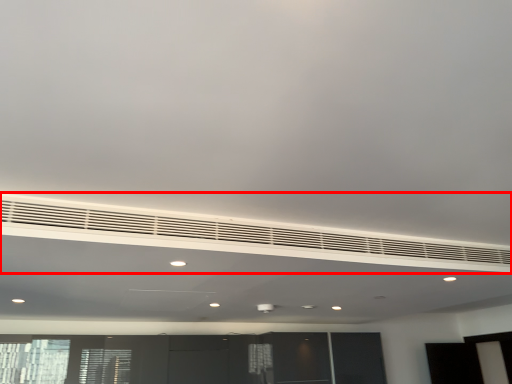
Question: From the image's perspective, what is the correct spatial relationship of air conditioning (annotated by the red box) in relation to entertainment center?

Choices:
 (A) above
 (B) below

Answer: (A)